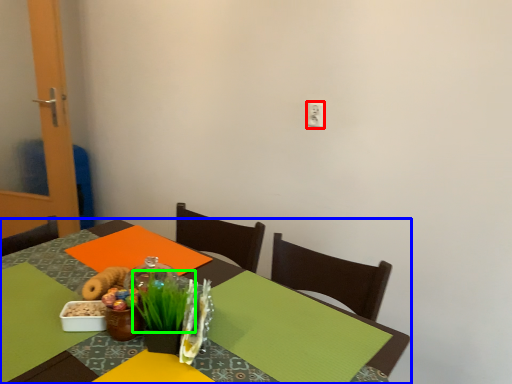
Question: Which object is the farthest from electric outlet (highlighted by a red box)? Choose among these: table (highlighted by a blue box) or grass (highlighted by a green box).

Choices:
 (A) table
 (B) grass

Answer: (B)